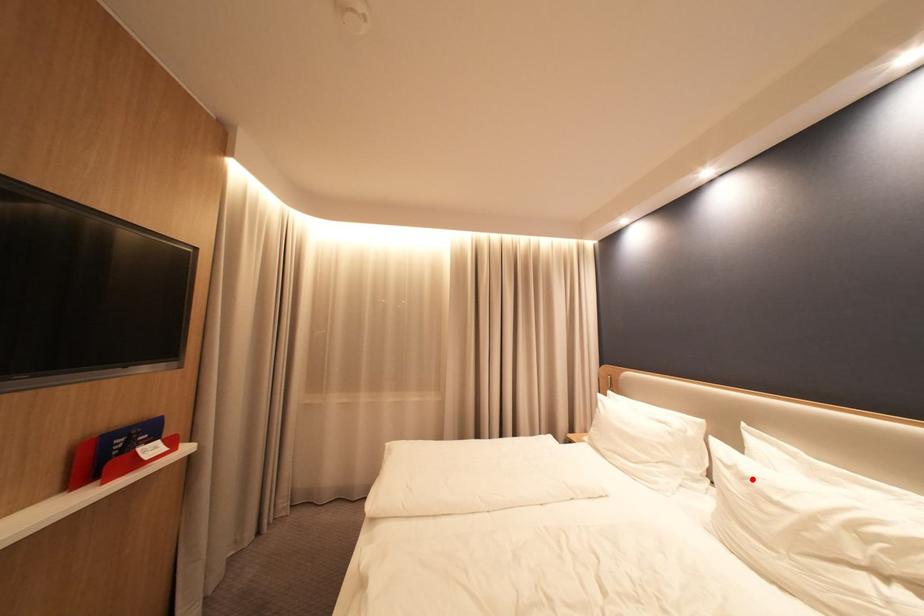
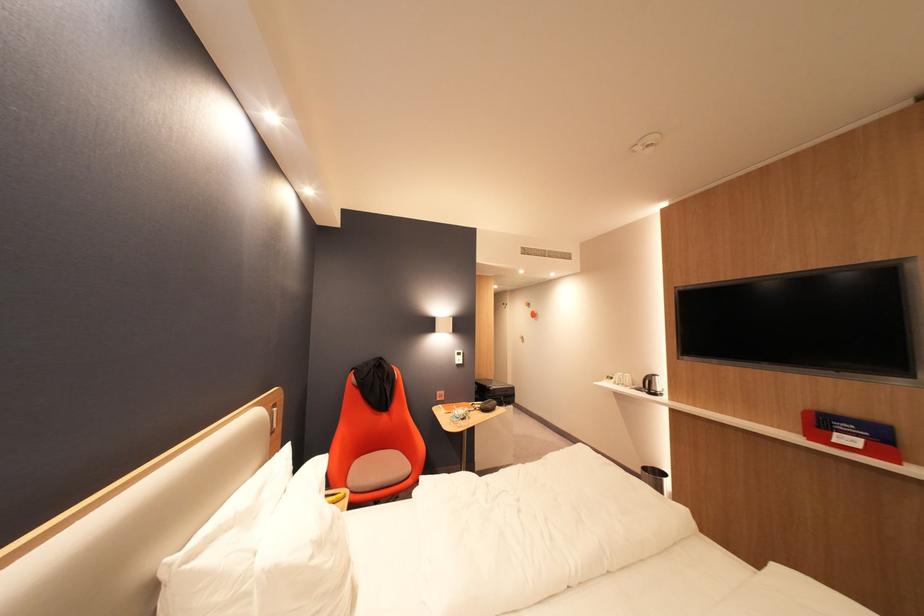
Locate, in the second image, the point that corresponds to the highlighted location in the first image.

(330, 545)